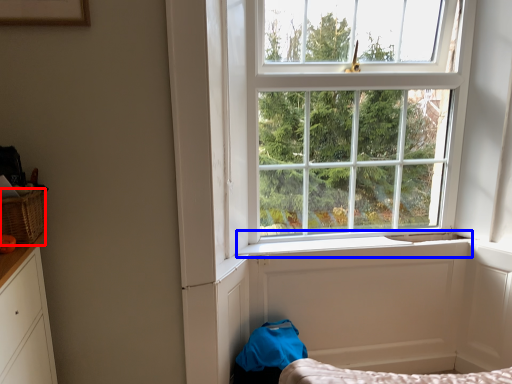
Question: Which object appears closest to the camera in this image, basket (highlighted by a red box) or window sill (highlighted by a blue box)?

Choices:
 (A) basket
 (B) window sill

Answer: (A)